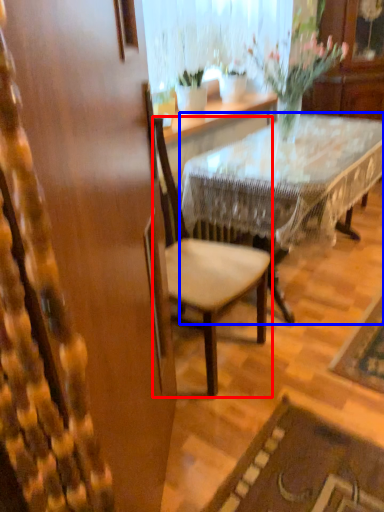
Question: Which object appears closest to the camera in this image, chair (highlighted by a red box) or desk (highlighted by a blue box)?

Choices:
 (A) chair
 (B) desk

Answer: (A)